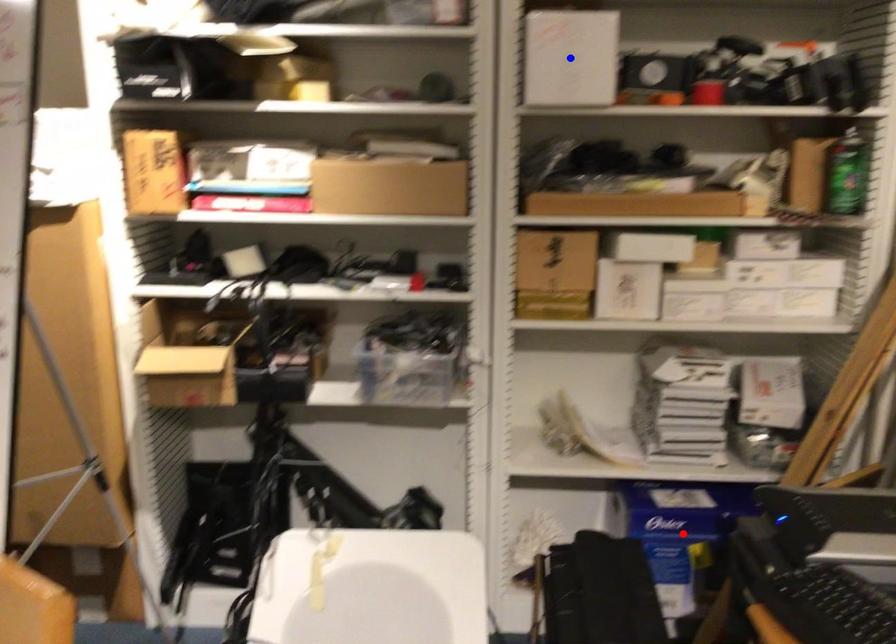
Question: Two points are marked on the image. Which point is closer to the camera?

Choices:
 (A) Blue point is closer.
 (B) Red point is closer.

Answer: (A)